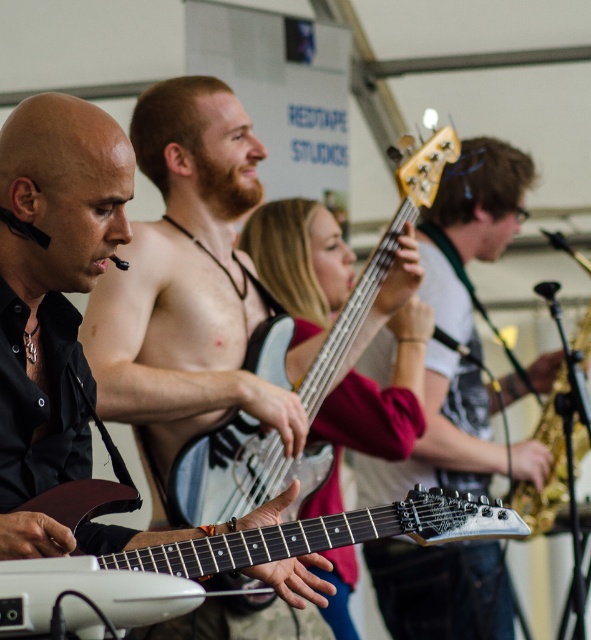
Question: Which object is the farthest from the white matte electric guitar at center?

Choices:
 (A) matte white bass guitar at center
 (B) white glossy electric guitar at center

Answer: (A)

Question: In this image, where is white matte electric guitar at center located relative to white glossy electric guitar at center?

Choices:
 (A) above
 (B) below

Answer: (B)

Question: Is matte white bass guitar at center bigger than white matte electric guitar at center?

Choices:
 (A) yes
 (B) no

Answer: (A)

Question: Is matte white bass guitar at center to the right of white matte electric guitar at center from the viewer's perspective?

Choices:
 (A) no
 (B) yes

Answer: (B)

Question: Which of the following is the closest to the observer?

Choices:
 (A) (291, 524)
 (B) (426, 480)

Answer: (A)

Question: Estimate the real-world distances between objects in this image. Which object is closer to the white matte electric guitar at center?

Choices:
 (A) matte white bass guitar at center
 (B) white glossy electric guitar at center

Answer: (B)